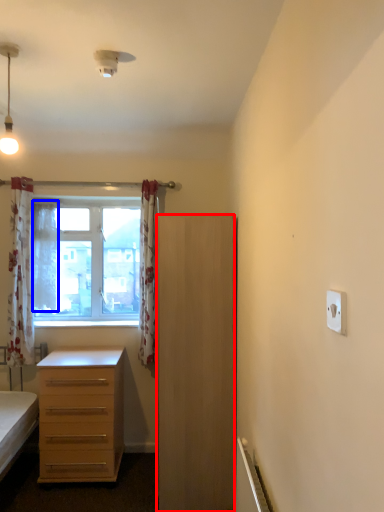
Question: Among these objects, which one is farthest to the camera, cabinetry (highlighted by a red box) or curtain (highlighted by a blue box)?

Choices:
 (A) cabinetry
 (B) curtain

Answer: (B)